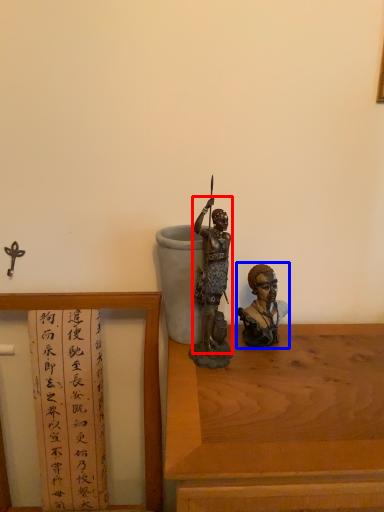
Question: Which object is closer to the camera taking this photo, person (highlighted by a red box) or person (highlighted by a blue box)?

Choices:
 (A) person
 (B) person

Answer: (A)